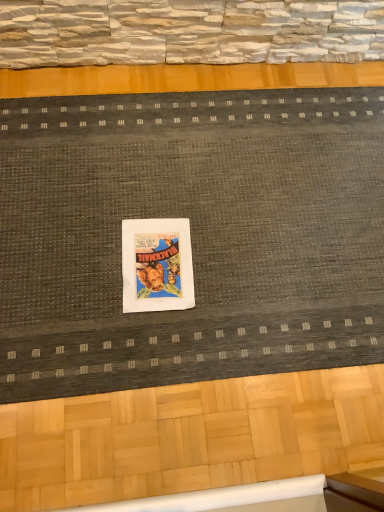
Where is `vacant location below dark gray woven mat at center (from a real-world perspective)`? The width and height of the screenshot is (384, 512). vacant location below dark gray woven mat at center (from a real-world perspective) is located at coordinates (210, 221).